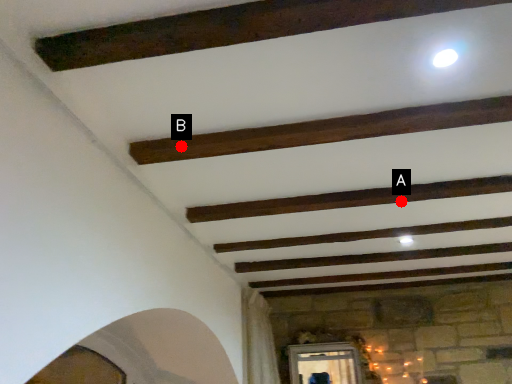
Question: Two points are circled on the image, labeled by A and B beside each circle. Which point appears farthest from the camera in this image?

Choices:
 (A) A is further
 (B) B is further

Answer: (A)